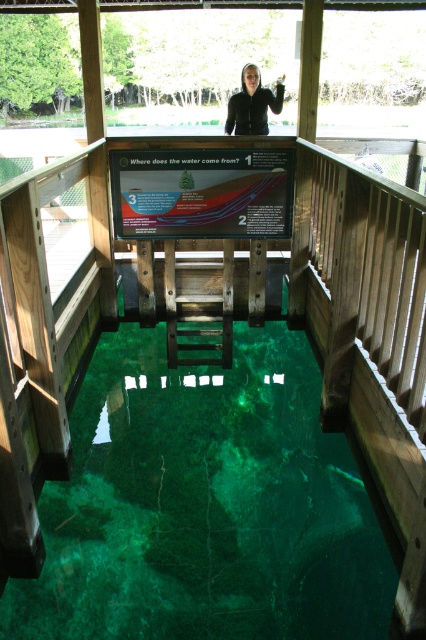
Which of these two, green translucent water at center or black matte jacket at upper center, stands taller?

green translucent water at center is taller.

Does point (229, 554) come in front of point (275, 102)?

Yes, point (229, 554) is closer to viewer.

Which is in front, point (256, 408) or point (250, 93)?

Point (256, 408)

Where is `green translucent water at center`? Image resolution: width=426 pixels, height=640 pixels. green translucent water at center is located at coordinates (204, 506).